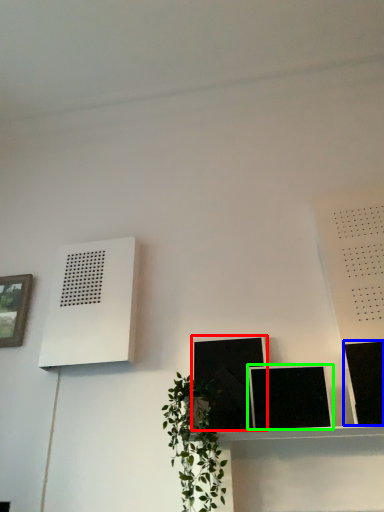
Question: Considering the real-world distances, which object is farthest from picture frame (highlighted by a red box)? picture frame (highlighted by a blue box) or picture frame (highlighted by a green box)?

Choices:
 (A) picture frame
 (B) picture frame

Answer: (A)